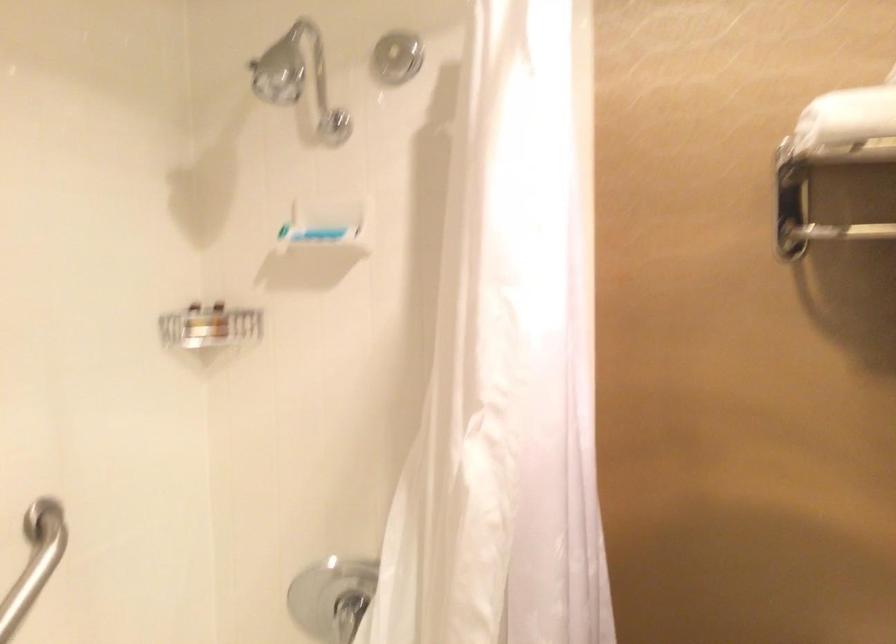
Where is `metal grab bar`? metal grab bar is located at coordinates (35, 562).